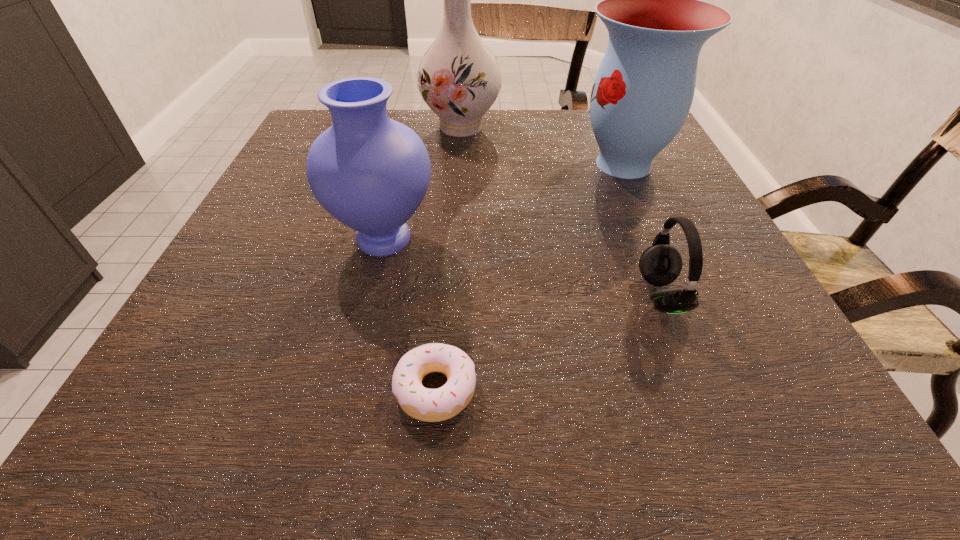
The image size is (960, 540). I want to click on the rightmost vase, so click(x=642, y=93).

Where is `the nearest vase`? the nearest vase is located at coordinates (371, 173).

Find the location of a particular element. This screenshot has height=540, width=960. the fourth tallest object is located at coordinates (660, 264).

Locate an element on the screen. the shortest object is located at coordinates (430, 405).

Where is `the nearest object`? This screenshot has height=540, width=960. the nearest object is located at coordinates (430, 405).

You are a GUI agent. You are given a task and a screenshot of the screen. Output one action in this format:
    pyautogui.click(x=<x>, y=<y>)
    Task: Click on the free space located on the front of the rightmost vase
    This screenshot has height=540, width=960.
    Given the screenshot: What is the action you would take?
    pyautogui.click(x=672, y=275)

Identify the location of vacant space located on the right of the nearest vase. (529, 239).

Locate an element on the screen. This screenshot has width=960, height=540. free space located 0.240m on the ear cups of the second shortest object is located at coordinates (491, 296).

Image resolution: width=960 pixels, height=540 pixels. I want to click on vacant space located 0.170m on the ear cups of the second shortest object, so click(x=535, y=296).

Locate an element on the screen. vacant position located on the ear cups of the second shortest object is located at coordinates (585, 296).